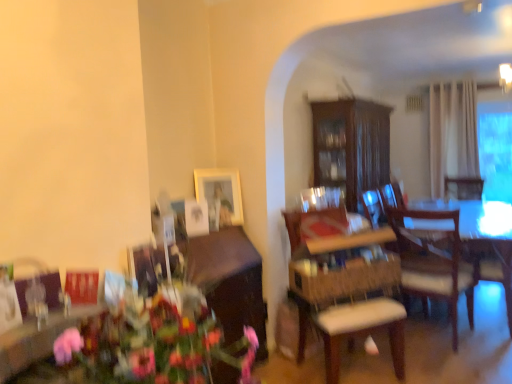
The height and width of the screenshot is (384, 512). Find the location of `empty space that is in between wooden armchair at right and wooden chair with white cushion at right, the first chair positioned from the bottom`. empty space that is in between wooden armchair at right and wooden chair with white cushion at right, the first chair positioned from the bottom is located at coordinates (432, 339).